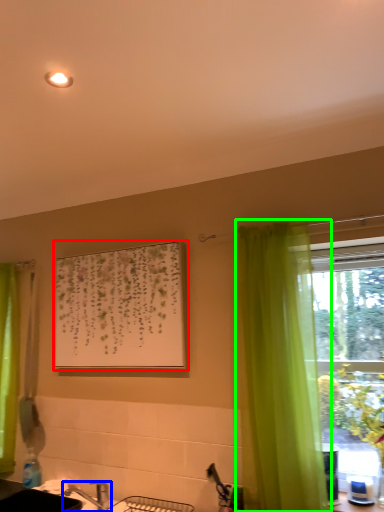
Question: Which object is positioned farthest from picture frame (highlighted by a red box)? Select from tap (highlighted by a blue box) and curtain (highlighted by a green box).

Choices:
 (A) tap
 (B) curtain

Answer: (A)